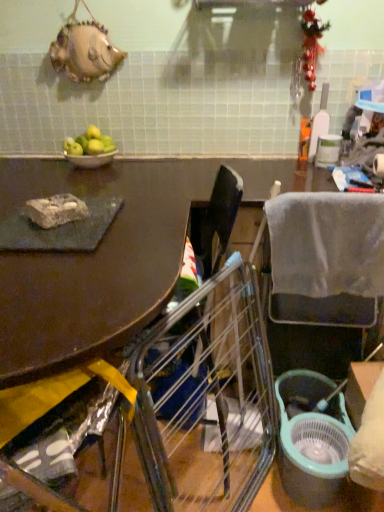
Question: Is point (329, 349) closer or farther from the camera than point (54, 218)?

Choices:
 (A) farther
 (B) closer

Answer: (A)

Question: Considering the positions of gray fabric chair at right, which ranks as the first chair in back-to-front order, and rocky stone at left in the image, is gray fabric chair at right, which ranks as the first chair in back-to-front order, bigger or smaller than rocky stone at left?

Choices:
 (A) big
 (B) small

Answer: (A)

Question: Considering the real-world distances, which object is closest to the metallic silver chair at lower left, the 1th chair viewed from the left?

Choices:
 (A) green matte apples at upper left
 (B) rocky stone at left
 (C) metallic silver bowl at upper left
 (D) gray fabric chair at right, arranged as the second chair when viewed from the front

Answer: (D)

Question: Considering the real-world distances, which object is closest to the rocky stone at left?

Choices:
 (A) gray fabric chair at right, arranged as the second chair when viewed from the front
 (B) metallic silver bowl at upper left
 (C) green matte apples at upper left
 (D) metallic silver chair at lower left, arranged as the 2th chair when viewed from the back

Answer: (B)